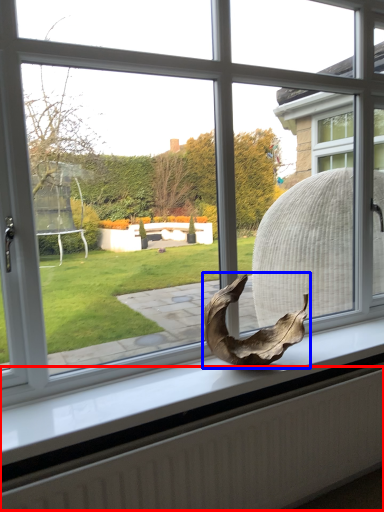
Question: Which point is closer to the camera, radiator (highlighted by a red box) or animal (highlighted by a blue box)?

Choices:
 (A) radiator
 (B) animal

Answer: (A)